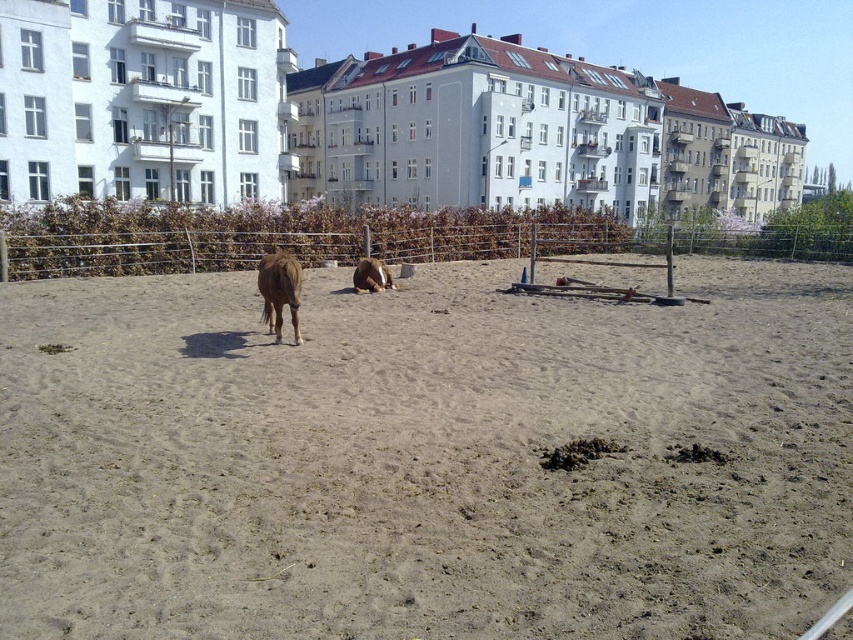
Question: Which of these objects is positioned closest to the brown wire mesh fence at upper center?

Choices:
 (A) brown furry horse at center
 (B) brown sandy ground at center
 (C) brown fuzzy horse at center

Answer: (B)

Question: Estimate the real-world distances between objects in this image. Which object is farther from the brown sandy ground at center?

Choices:
 (A) brown fuzzy horse at center
 (B) brown furry horse at center
 (C) brown wire mesh fence at upper center

Answer: (C)

Question: Does brown wire mesh fence at upper center come behind brown fuzzy horse at center?

Choices:
 (A) yes
 (B) no

Answer: (A)

Question: Is brown sandy ground at center positioned before brown furry horse at center?

Choices:
 (A) no
 (B) yes

Answer: (B)

Question: Which object is closer to the camera taking this photo?

Choices:
 (A) brown wire mesh fence at upper center
 (B) brown furry horse at center
 (C) brown fuzzy horse at center
 (D) brown sandy ground at center

Answer: (D)

Question: Does brown fuzzy horse at center appear on the left side of brown furry horse at center?

Choices:
 (A) yes
 (B) no

Answer: (A)